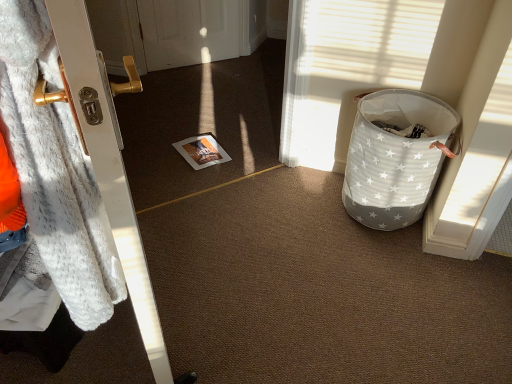
Question: Visually, is white star-patterned fabric basket at right positioned to the left or to the right of fuzzy white blanket at left?

Choices:
 (A) left
 (B) right

Answer: (B)

Question: Considering the positions of white star-patterned fabric basket at right and fuzzy white blanket at left in the image, is white star-patterned fabric basket at right wider or thinner than fuzzy white blanket at left?

Choices:
 (A) wide
 (B) thin

Answer: (A)

Question: Which object is positioned closest to the fuzzy white blanket at left?

Choices:
 (A) white fur coat at left
 (B) white star-patterned fabric basket at right

Answer: (A)

Question: Which of these objects is positioned closest to the fuzzy white blanket at left?

Choices:
 (A) white fur coat at left
 (B) white star-patterned fabric basket at right

Answer: (A)